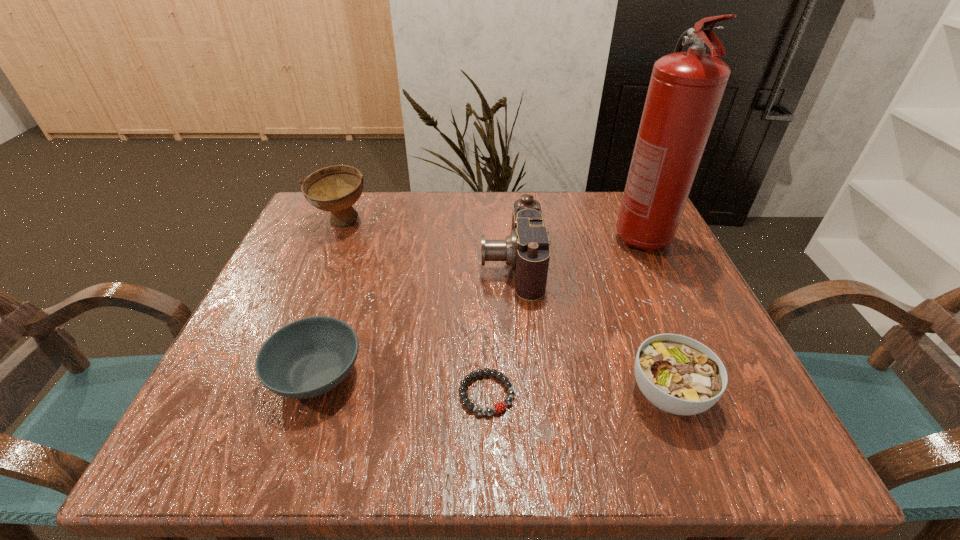
Identify the location of free space between the bracelet and the tallest object. This screenshot has width=960, height=540. (564, 316).

Where is `free spot between the shortest object and the shortest soup bowl`? free spot between the shortest object and the shortest soup bowl is located at coordinates (401, 384).

In order to click on blank region between the camera and the bracelet in this screenshot , I will do `click(499, 329)`.

Where is `vacant space in between the third shortest object and the shortest object`? This screenshot has height=540, width=960. vacant space in between the third shortest object and the shortest object is located at coordinates (578, 394).

Identify the location of unoccupied position between the second shortest object and the camera. This screenshot has height=540, width=960. (414, 319).

Find the location of `free point between the shortest object and the camera`. free point between the shortest object and the camera is located at coordinates (499, 329).

Where is `vacant point located between the rightmost soup bowl and the camera`? vacant point located between the rightmost soup bowl and the camera is located at coordinates (589, 329).

In order to click on free space between the shortest soup bowl and the shortest object in this screenshot , I will do `click(401, 384)`.

Locate an element on the screen. This screenshot has width=960, height=540. free spot between the third shortest object and the shortest soup bowl is located at coordinates (492, 384).

The height and width of the screenshot is (540, 960). I want to click on vacant area between the camera and the farthest soup bowl, so click(426, 243).